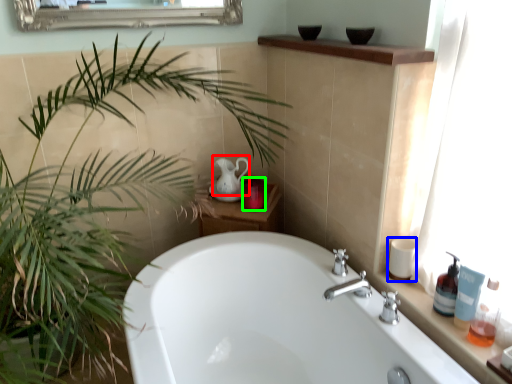
Question: Considering the real-world distances, which object is closest to tea pot (highlighted by a red box)? toiletry (highlighted by a blue box) or toiletry (highlighted by a green box).

Choices:
 (A) toiletry
 (B) toiletry

Answer: (B)